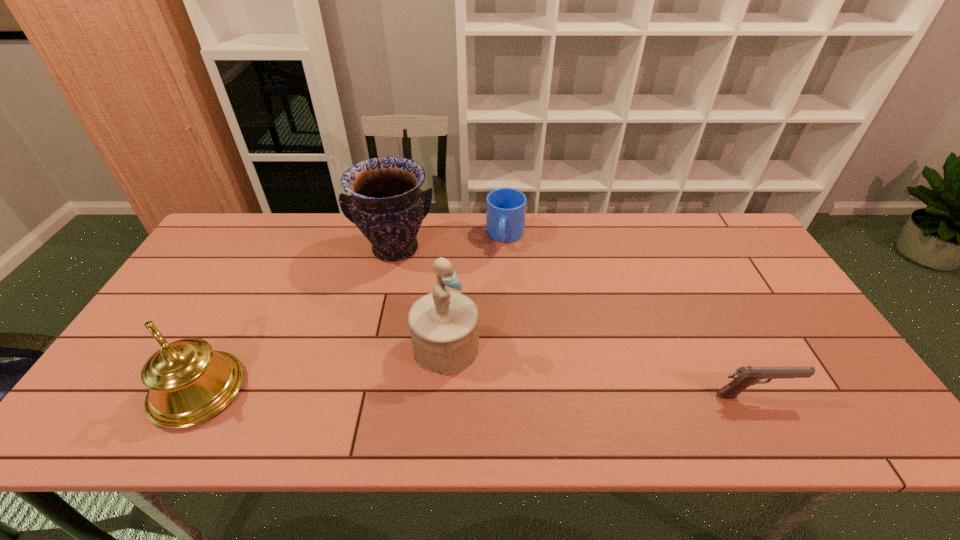
Find the location of `free space on the desktop that is between the leftmost object and the rightmost object and is positioned on the side of the mug with the handle`. free space on the desktop that is between the leftmost object and the rightmost object and is positioned on the side of the mug with the handle is located at coordinates (474, 393).

At what (x,y) coordinates should I click in order to perform the action: click on vacant space on the desktop that is between the leftmost object and the rightmost object and is positioned on the front handle of the pottery. Please return your answer as a coordinate pair (x, y). This screenshot has height=540, width=960. Looking at the image, I should click on pyautogui.click(x=412, y=393).

Image resolution: width=960 pixels, height=540 pixels. Find the location of `free space on the desktop that is between the bell and the pistol and is positioned at the beak of the figurine`. free space on the desktop that is between the bell and the pistol and is positioned at the beak of the figurine is located at coordinates (506, 393).